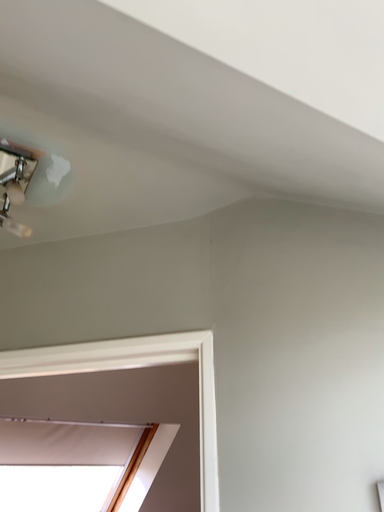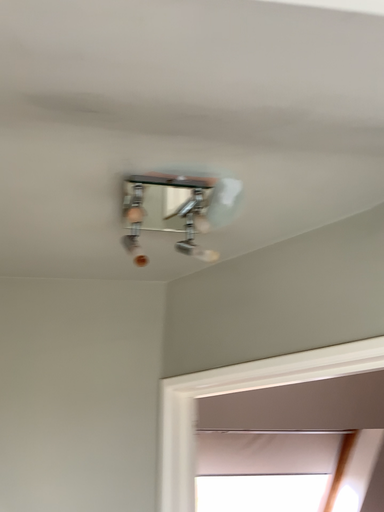
Question: How did the camera likely rotate when shooting the video?

Choices:
 (A) rotated left
 (B) rotated right

Answer: (A)